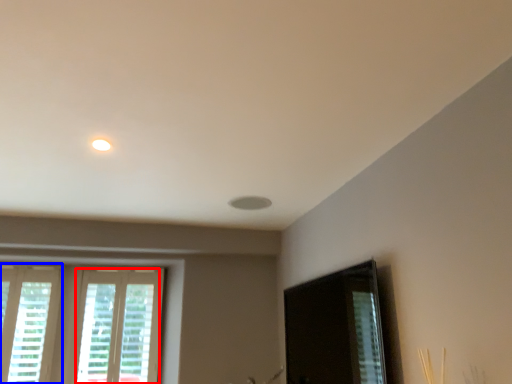
Question: Which object is further to the camera taking this photo, window (highlighted by a red box) or window (highlighted by a blue box)?

Choices:
 (A) window
 (B) window

Answer: (A)